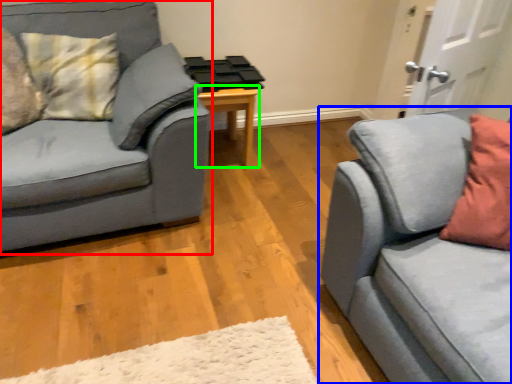
Question: Considering the real-world distances, which object is closest to studio couch (highlighted by a red box)? studio couch (highlighted by a blue box) or table (highlighted by a green box).

Choices:
 (A) studio couch
 (B) table

Answer: (B)